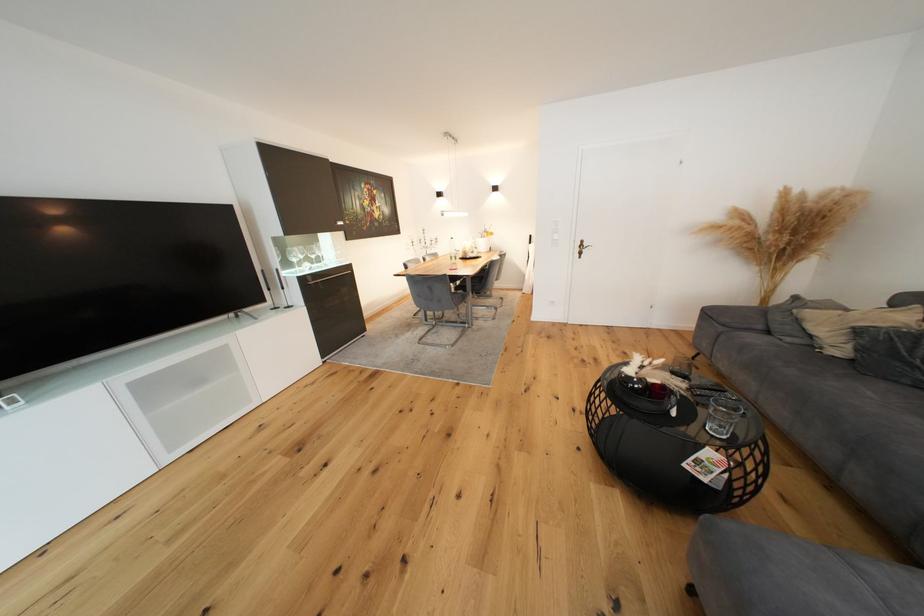
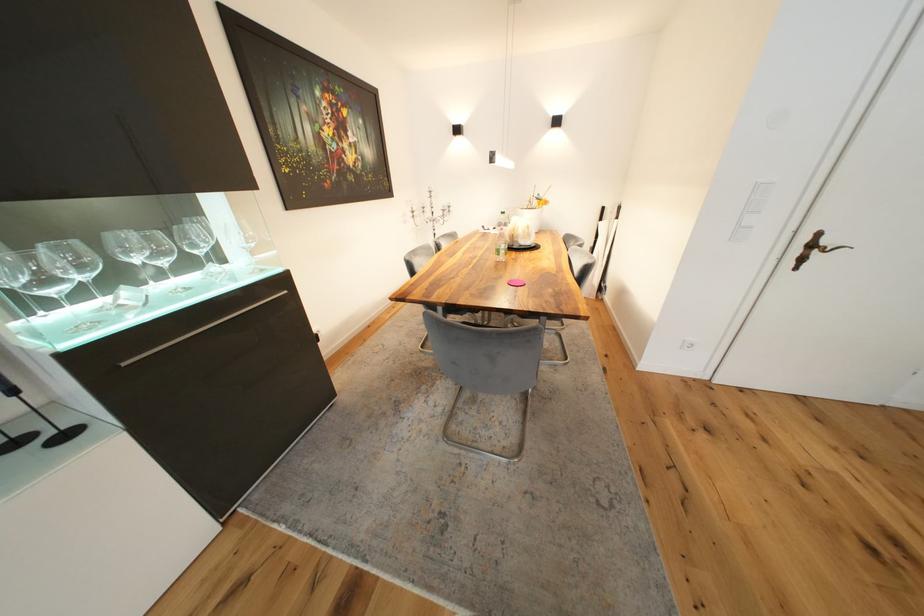
Question: What movement of the cameraman would produce the second image?

Choices:
 (A) Left
 (B) Right
 (C) Forward
 (D) Backward

Answer: (C)